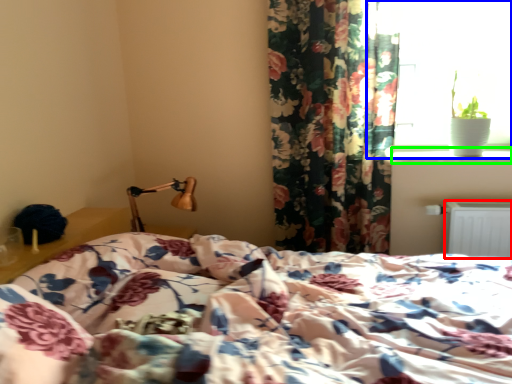
Question: Based on their relative distances, which object is nearer to radiator (highlighted by a red box)? Choose from window (highlighted by a blue box) and window sill (highlighted by a green box).

Choices:
 (A) window
 (B) window sill

Answer: (B)